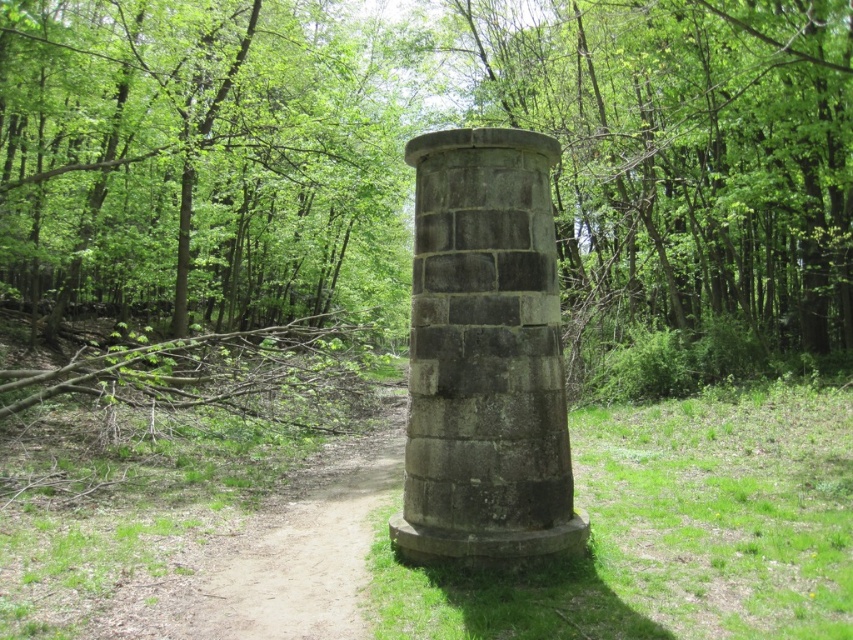
Can you confirm if gray stone column at center is wider than dirt path at lower left?

Yes.

Who is higher up, gray stone column at center or dirt path at lower left?

gray stone column at center

Is point (489, 147) behind point (257, 609)?

Yes.

You are a GUI agent. You are given a task and a screenshot of the screen. Output one action in this format:
    pyautogui.click(x=<x>, y=<y>)
    Task: Click on the gray stone column at center
    The width and height of the screenshot is (853, 640).
    Given the screenshot: What is the action you would take?
    pyautogui.click(x=485, y=356)